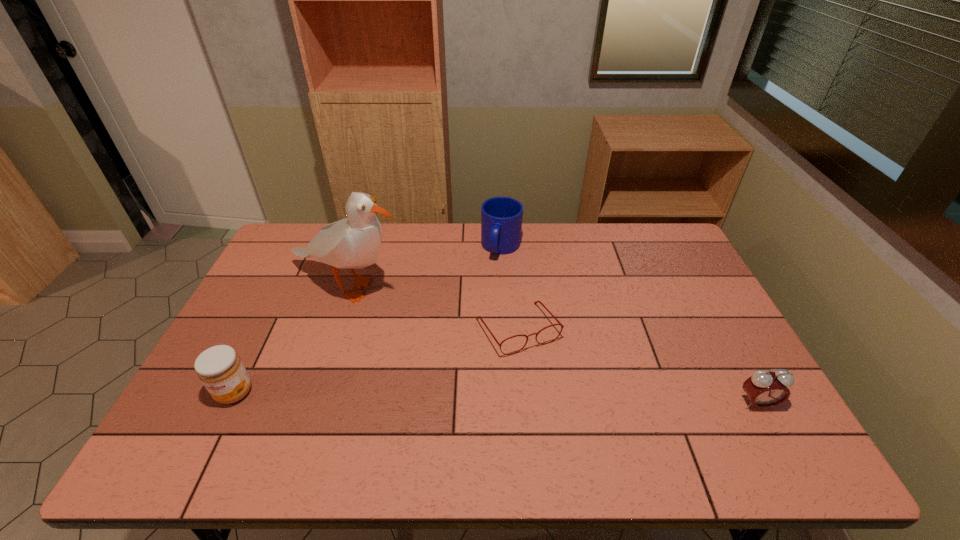
Find the location of `vacant space on the desktop that is between the jam and the rightmost object and is positioned on the side with the handle of the mug`. vacant space on the desktop that is between the jam and the rightmost object and is positioned on the side with the handle of the mug is located at coordinates (444, 397).

Identify the location of vacant space on the desktop that is between the jam and the alarm clock and is positioned on the face of the shortest object. The image size is (960, 540). (561, 399).

The height and width of the screenshot is (540, 960). I want to click on free space on the desktop that is between the jam and the alarm clock and is positioned at the beak of the gull, so click(x=434, y=396).